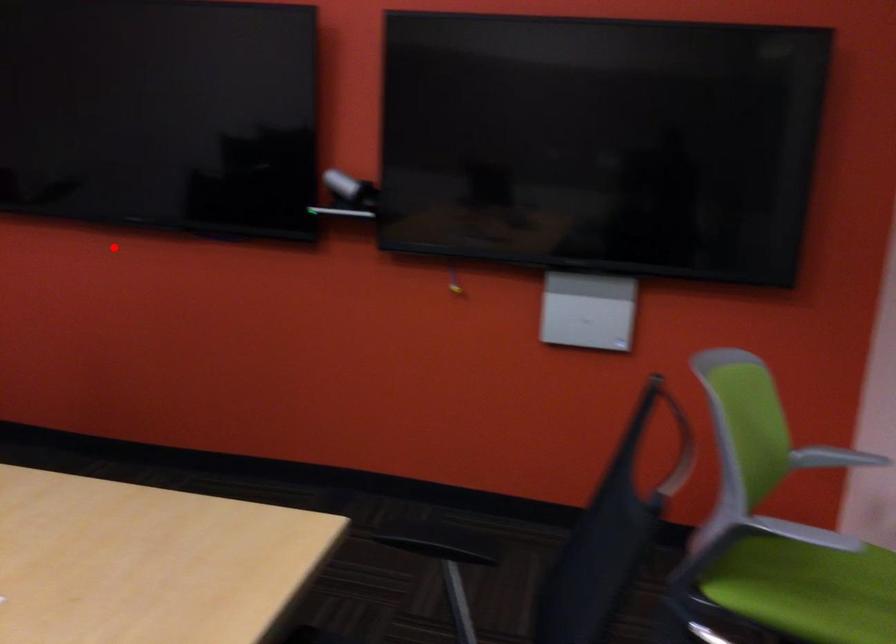
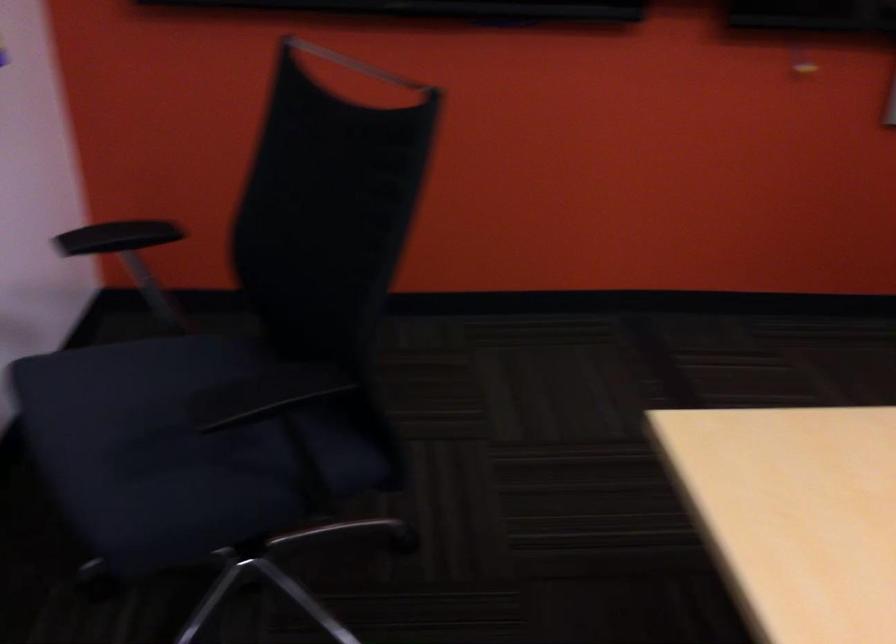
Locate, in the second image, the point that corresponds to the highlighted location in the first image.

(356, 64)